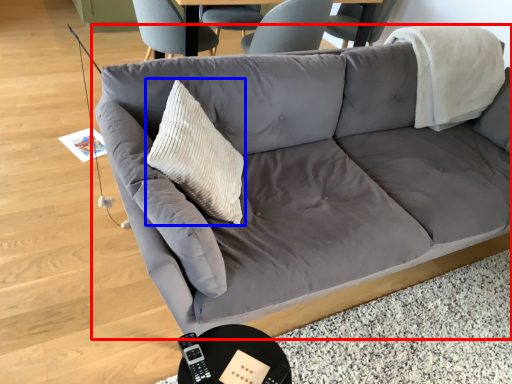
Question: Which object appears closest to the camera in this image, studio couch (highlighted by a red box) or throw pillow (highlighted by a blue box)?

Choices:
 (A) studio couch
 (B) throw pillow

Answer: (A)